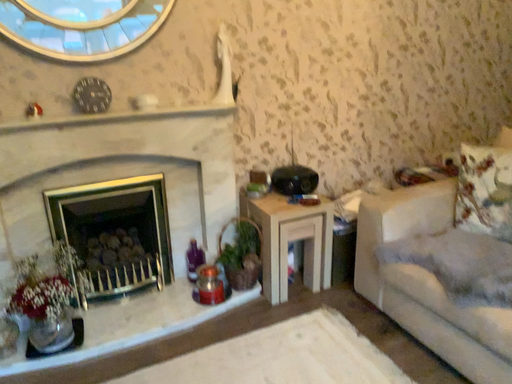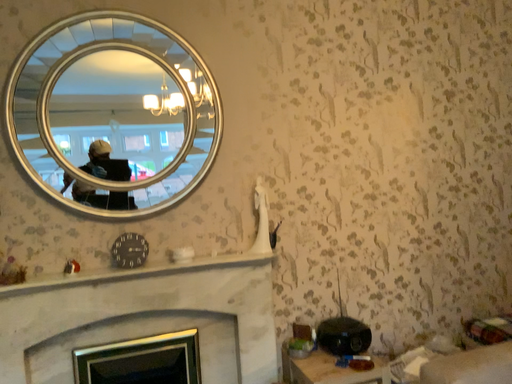
Question: How did the camera likely rotate when shooting the video?

Choices:
 (A) rotated downward
 (B) rotated upward

Answer: (B)